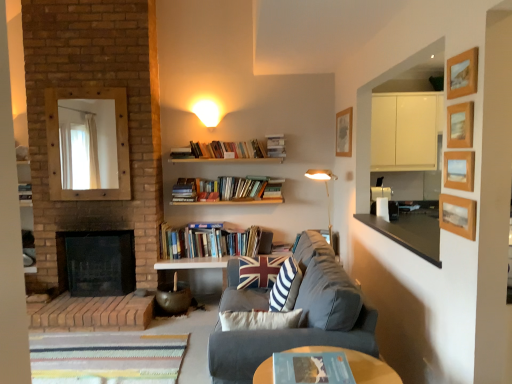
Identify the location of wooden mirror at upper left. (58, 143).

The width and height of the screenshot is (512, 384). I want to click on hardcover book at upper center, acting as the 1th book starting from the back, so click(x=276, y=145).

The image size is (512, 384). Describe the element at coordinates (462, 74) in the screenshot. I see `wooden picture frame at upper right, the 5th picture frame in the back-to-front sequence` at that location.

The height and width of the screenshot is (384, 512). I want to click on wooden picture frame at upper center, which appears as the fifth picture frame when viewed from the front, so click(x=344, y=133).

What do you see at coordinates (212, 242) in the screenshot? This screenshot has height=384, width=512. I see `hardcover books at center, the 2th book when ordered from back to front` at bounding box center [212, 242].

Describe the element at coordinates (458, 216) in the screenshot. I see `wooden picture frame at upper right, placed as the 4th picture frame when sorted from back to front` at that location.

Locate an element on the screen. This screenshot has height=384, width=512. wooden mirror at upper left is located at coordinates (58, 143).

Is wooden picture frame at upper right, the third picture frame positioned from the bottom, bigger than blue paper book at center, acting as the 1th book starting from the bottom?

Actually, wooden picture frame at upper right, the third picture frame positioned from the bottom, might be smaller than blue paper book at center, acting as the 1th book starting from the bottom.

Based on the photo, is wooden picture frame at upper right, placed as the 2th picture frame when sorted from back to front, far from blue paper book at center, acting as the 1th book starting from the bottom?

wooden picture frame at upper right, placed as the 2th picture frame when sorted from back to front, is far away from blue paper book at center, acting as the 1th book starting from the bottom.

Which of these two, wooden picture frame at upper right, the third picture frame positioned from the bottom, or blue paper book at center, placed as the third book when sorted from top to bottom, stands taller?

wooden picture frame at upper right, the third picture frame positioned from the bottom.

Could you tell me if wooden picture frame at upper right, the fourth picture frame positioned from the front, is turned towards blue paper book at center, placed as the third book when sorted from top to bottom?

No, wooden picture frame at upper right, the fourth picture frame positioned from the front, is not facing towards blue paper book at center, placed as the third book when sorted from top to bottom.

Is hardcover books at center, which is the second book from front to back, turned away from matte white wall sconce at upper center?

hardcover books at center, which is the second book from front to back, is not turned away from matte white wall sconce at upper center.

Based on the photo, from a real-world perspective, is hardcover books at center, marked as the 2th book in a top-to-bottom arrangement, physically located above or below matte white wall sconce at upper center?

From a real-world perspective, hardcover books at center, marked as the 2th book in a top-to-bottom arrangement, is physically below matte white wall sconce at upper center.

Does point (220, 256) appear closer or farther from the camera than point (214, 110)?

Point (220, 256) is positioned closer to the camera compared to point (214, 110).

Which of these two, blue paper book at center, acting as the 1th book starting from the bottom, or dark gray fabric couch at center, stands shorter?

Standing shorter between the two is blue paper book at center, acting as the 1th book starting from the bottom.

At what (x,y) coordinates should I click in order to perform the action: click on the 2nd book to the right when counting from the dark gray fabric couch at center. Please return your answer as a coordinate pair (x, y). Looking at the image, I should click on (312, 368).

Between blue paper book at center, marked as the 3th book in a back-to-front arrangement, and dark gray fabric couch at center, which one appears on the right side from the viewer's perspective?

blue paper book at center, marked as the 3th book in a back-to-front arrangement, is more to the right.

From a real-world perspective, between wooden picture frame at upper center, which appears as the fifth picture frame when viewed from the front, and brick fireplace at left, who is vertically lower?

In real-world perspective, brick fireplace at left is lower.

From the picture: Considering the sizes of wooden picture frame at upper center, the first picture frame positioned from the back, and brick fireplace at left in the image, is wooden picture frame at upper center, the first picture frame positioned from the back, taller or shorter than brick fireplace at left?

wooden picture frame at upper center, the first picture frame positioned from the back, is shorter than brick fireplace at left.

Is wooden picture frame at upper center, which appears as the fifth picture frame when viewed from the front, outside of brick fireplace at left?

wooden picture frame at upper center, which appears as the fifth picture frame when viewed from the front, is positioned outside brick fireplace at left.

Identify the location of fireplace below the wooden picture frame at upper center, the first picture frame positioned from the back (from the image's perspective). The image size is (512, 384). (96, 263).

Who is shorter, wooden picture frame at upper center, the first picture frame positioned from the back, or striped fabric throw pillow at center?

wooden picture frame at upper center, the first picture frame positioned from the back.

This screenshot has height=384, width=512. Identify the location of throw pillow on the left of the wooden picture frame at upper center, the first picture frame positioned from the back. [285, 287].

Is point (351, 119) closer to viewer compared to point (293, 287)?

That is False.

From a real-world perspective, who is located lower, hardcover books at center, the 2th book when ordered from back to front, or dark gray fabric couch at center?

dark gray fabric couch at center, from a real-world perspective.

Does point (267, 246) come in front of point (234, 373)?

That is False.

From the image's perspective, would you say hardcover books at center, the 2th book when ordered from back to front, is shown under dark gray fabric couch at center?

No, from the image's perspective, hardcover books at center, the 2th book when ordered from back to front, is not below dark gray fabric couch at center.

Is hardcover books at center, the 2th book when ordered from back to front, oriented towards dark gray fabric couch at center?

Yes, hardcover books at center, the 2th book when ordered from back to front, is turned towards dark gray fabric couch at center.

Which object is further away from the camera taking this photo, hardcover book at upper center, acting as the 1th book starting from the back, or union jack fabric pillow at center?

hardcover book at upper center, acting as the 1th book starting from the back, is more distant.

Is hardcover book at upper center, the 3th book in the front-to-back sequence, looking in the opposite direction of union jack fabric pillow at center?

hardcover book at upper center, the 3th book in the front-to-back sequence, is not turned away from union jack fabric pillow at center.

Is hardcover book at upper center, the 3th book in the front-to-back sequence, in contact with union jack fabric pillow at center?

No, hardcover book at upper center, the 3th book in the front-to-back sequence, is not in contact with union jack fabric pillow at center.

How different are the orientations of hardcover book at upper center, the third book from the bottom, and union jack fabric pillow at center in degrees?

There is a 1.11-degree angle between the facing directions of hardcover book at upper center, the third book from the bottom, and union jack fabric pillow at center.

Where is `the 3rd picture frame directly above the blue paper book at center, acting as the 1th book starting from the bottom (from a real-world perspective)`? This screenshot has width=512, height=384. the 3rd picture frame directly above the blue paper book at center, acting as the 1th book starting from the bottom (from a real-world perspective) is located at coordinates (460, 125).

The image size is (512, 384). What are the coordinates of `light fixture behind the hardcover books at center, the 2th book when ordered from back to front` in the screenshot? It's located at (207, 112).

From the image, which object appears to be nearer to striped fabric throw pillow at center, wooden picture frame at upper right, placed as the 2th picture frame when sorted from back to front, or hardcover book at upper center, acting as the 1th book starting from the back?

wooden picture frame at upper right, placed as the 2th picture frame when sorted from back to front, is positioned closer to the anchor striped fabric throw pillow at center.

Based on their spatial positions, is hardcover book at upper center, the 3th book in the front-to-back sequence, or brick fireplace at left closer to wooden picture frame at upper right, which is counted as the 2th picture frame, starting from the bottom?

Among the two, hardcover book at upper center, the 3th book in the front-to-back sequence, is located nearer to wooden picture frame at upper right, which is counted as the 2th picture frame, starting from the bottom.

Estimate the real-world distances between objects in this image. Which object is further from wooden picture frame at upper center, marked as the first picture frame in a top-to-bottom arrangement, wooden picture frame at upper right, the 5th picture frame in the back-to-front sequence, or dark gray fabric couch at center?

wooden picture frame at upper right, the 5th picture frame in the back-to-front sequence.

Looking at the image, which one is located closer to wooden picture frame at upper right, which ranks as the third picture frame in back-to-front order, wooden picture frame at upper right, which appears as the 1th picture frame when viewed from the front, or brick fireplace at left?

The object closer to wooden picture frame at upper right, which ranks as the third picture frame in back-to-front order, is wooden picture frame at upper right, which appears as the 1th picture frame when viewed from the front.

From the image, which object appears to be nearer to matte white wall sconce at upper center, hardcover book at upper center, the first book in the top-to-bottom sequence, or dark gray fabric couch at center?

hardcover book at upper center, the first book in the top-to-bottom sequence.

Based on their spatial positions, is brick fireplace at left or hardcover books at center, which ranks as the 2th book in bottom-to-top order, closer to blue paper book at center, placed as the third book when sorted from top to bottom?

hardcover books at center, which ranks as the 2th book in bottom-to-top order.

Considering their positions, is wooden picture frame at upper right, which is counted as the 2th picture frame, starting from the bottom, positioned further to blue paper book at center, marked as the 3th book in a back-to-front arrangement, than wooden mirror at upper left?

wooden mirror at upper left.

Estimate the real-world distances between objects in this image. Which object is closer to union jack fabric pillow at center, matte white wall sconce at upper center or blue paper book at center, marked as the 3th book in a back-to-front arrangement?

Among the two, matte white wall sconce at upper center is located nearer to union jack fabric pillow at center.

Where is `mirror between wooden picture frame at upper right, positioned as the fifth picture frame in top-to-bottom order, and hardcover books at center, marked as the 2th book in a top-to-bottom arrangement, in the front-back direction`? Image resolution: width=512 pixels, height=384 pixels. mirror between wooden picture frame at upper right, positioned as the fifth picture frame in top-to-bottom order, and hardcover books at center, marked as the 2th book in a top-to-bottom arrangement, in the front-back direction is located at coordinates (58, 143).

The width and height of the screenshot is (512, 384). I want to click on throw pillow between dark gray fabric couch at center and wooden picture frame at upper center, marked as the first picture frame in a top-to-bottom arrangement, in the front-back direction, so click(x=285, y=287).

Where is `throw pillow between wooden picture frame at upper right, the fourth picture frame ordered from the bottom, and blue paper book at center, marked as the 3th book in a back-to-front arrangement, from top to bottom`? Image resolution: width=512 pixels, height=384 pixels. throw pillow between wooden picture frame at upper right, the fourth picture frame ordered from the bottom, and blue paper book at center, marked as the 3th book in a back-to-front arrangement, from top to bottom is located at coordinates (285, 287).

Find the location of `fireplace located between wooden picture frame at upper right, the fourth picture frame positioned from the front, and hardcover books at center, the 2th book when ordered from back to front, in the depth direction`. fireplace located between wooden picture frame at upper right, the fourth picture frame positioned from the front, and hardcover books at center, the 2th book when ordered from back to front, in the depth direction is located at coordinates (96, 263).